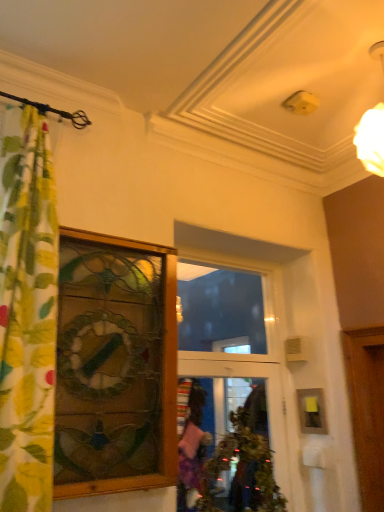
Question: Is wooden stained glass window at left a part of green floral fabric curtain at left?

Choices:
 (A) yes
 (B) no

Answer: (B)

Question: From the image's perspective, is green floral fabric curtain at left located above wooden stained glass window at left?

Choices:
 (A) no
 (B) yes

Answer: (B)

Question: Is green floral fabric curtain at left looking in the opposite direction of wooden stained glass window at left?

Choices:
 (A) no
 (B) yes

Answer: (A)

Question: From a real-world perspective, is green floral fabric curtain at left beneath wooden stained glass window at left?

Choices:
 (A) no
 (B) yes

Answer: (A)

Question: From the image's perspective, is green floral fabric curtain at left below wooden stained glass window at left?

Choices:
 (A) no
 (B) yes

Answer: (A)

Question: Is point (0, 296) closer or farther from the camera than point (256, 287)?

Choices:
 (A) farther
 (B) closer

Answer: (B)

Question: From the image's perspective, is green floral fabric curtain at left above or below transparent glass window at center?

Choices:
 (A) below
 (B) above

Answer: (B)

Question: Choose the correct answer: Is green floral fabric curtain at left inside transparent glass window at center or outside it?

Choices:
 (A) inside
 (B) outside

Answer: (B)

Question: Is green floral fabric curtain at left to the left or to the right of transparent glass window at center in the image?

Choices:
 (A) left
 (B) right

Answer: (A)

Question: Is green floral fabric curtain at left to the left or to the right of wooden stained glass window at left in the image?

Choices:
 (A) left
 (B) right

Answer: (A)

Question: Is point (49, 385) closer or farther from the camera than point (142, 286)?

Choices:
 (A) farther
 (B) closer

Answer: (B)

Question: From their relative heights in the image, would you say green floral fabric curtain at left is taller or shorter than wooden stained glass window at left?

Choices:
 (A) short
 (B) tall

Answer: (B)

Question: From the image's perspective, is green floral fabric curtain at left located above or below wooden stained glass window at left?

Choices:
 (A) above
 (B) below

Answer: (A)

Question: Considering the relative positions of wooden picture frame at right and transparent glass window at center in the image provided, is wooden picture frame at right to the left or to the right of transparent glass window at center?

Choices:
 (A) left
 (B) right

Answer: (B)

Question: From a real-world perspective, is wooden picture frame at right physically located above or below transparent glass window at center?

Choices:
 (A) below
 (B) above

Answer: (A)